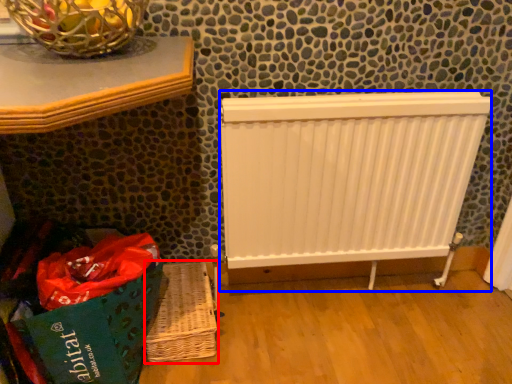
Question: Which object appears closest to the camera in this image, basket (highlighted by a red box) or radiator (highlighted by a blue box)?

Choices:
 (A) basket
 (B) radiator

Answer: (B)